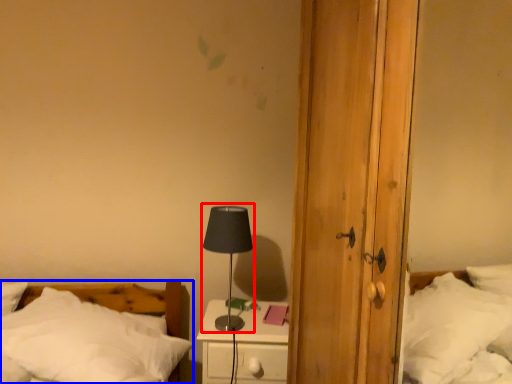
Question: Among these objects, which one is farthest to the camera, table lamp (highlighted by a red box) or bed (highlighted by a blue box)?

Choices:
 (A) table lamp
 (B) bed

Answer: (A)